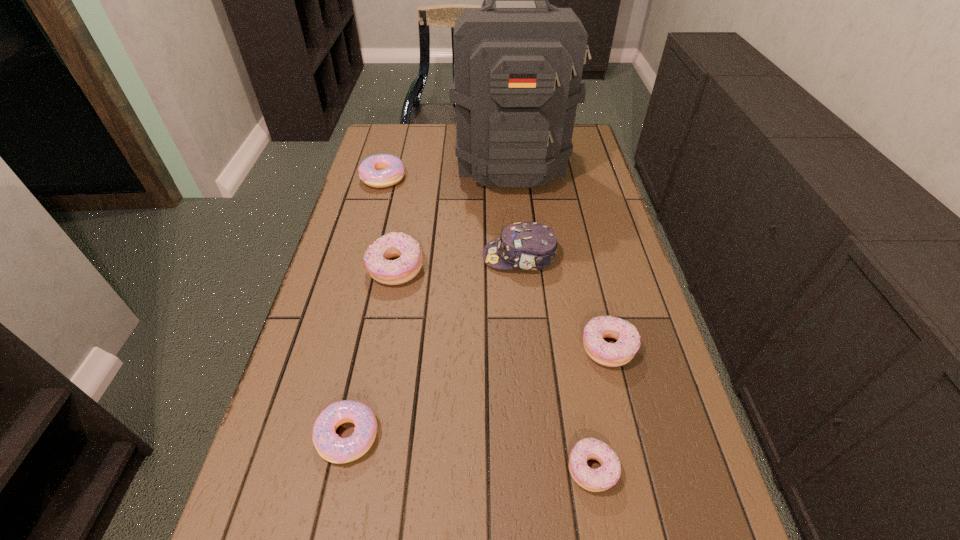
You are a GUI agent. You are given a task and a screenshot of the screen. Output one action in this format:
    pyautogui.click(x=<x>, y=<y>)
    Task: Click on the nearest purple doughnut
    This screenshot has height=540, width=960.
    Given the screenshot: What is the action you would take?
    pyautogui.click(x=600, y=479)

Where is `vacant space located on the front compartment of the gray backpack`? vacant space located on the front compartment of the gray backpack is located at coordinates (519, 244).

Find the location of a particular element. The image size is (960, 540). vacant point located 0.150m on the front-facing side of the headwear is located at coordinates (427, 256).

Identify the location of vacant space situated on the front-facing side of the headwear. (438, 256).

Where is `vacant space located on the front-facing side of the headwear`? Image resolution: width=960 pixels, height=540 pixels. vacant space located on the front-facing side of the headwear is located at coordinates (400, 256).

Identify the location of free spot located on the back of the second farthest doughnut. (404, 221).

Locate an element on the screen. The width and height of the screenshot is (960, 540). free space located 0.110m on the right of the farthest doughnut is located at coordinates (439, 178).

The width and height of the screenshot is (960, 540). I want to click on vacant space situated 0.150m on the left of the third farthest doughnut, so click(514, 348).

Locate an element on the screen. The height and width of the screenshot is (540, 960). vacant area located on the right of the nearer pink doughnut is located at coordinates (416, 436).

In order to click on free region located on the back of the smallest purple doughnut in this screenshot , I will do `click(578, 388)`.